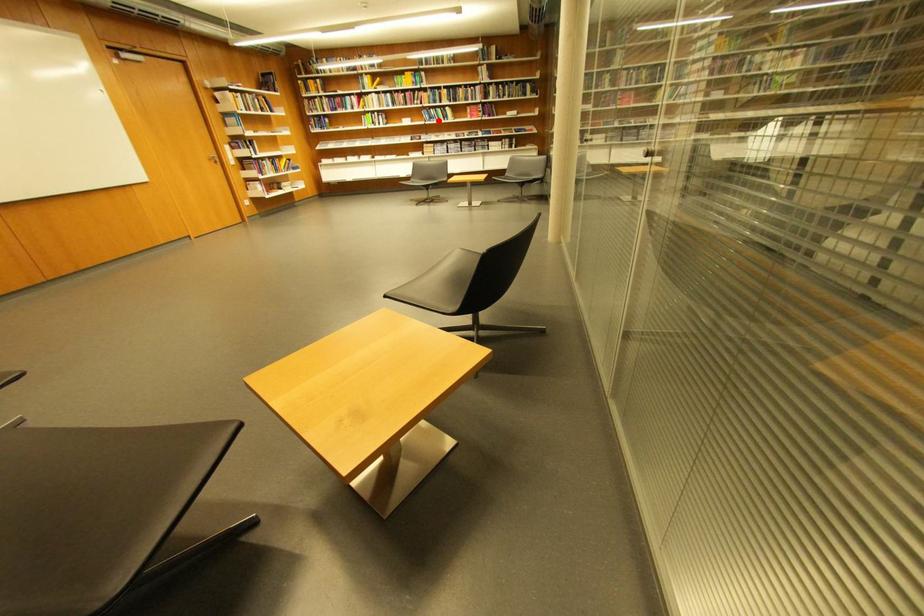
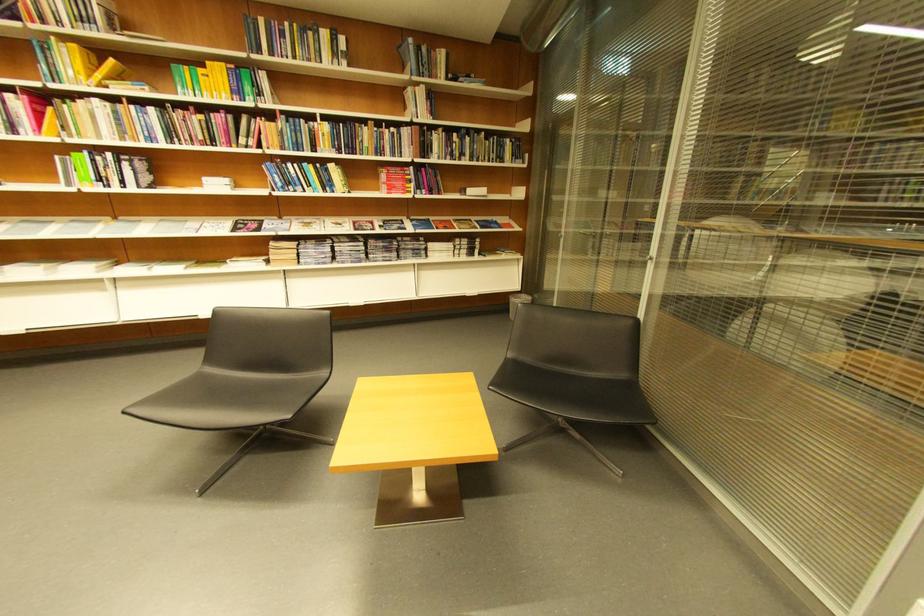
Question: I am providing you with two images of the same scene from different viewpoints. Given a red point in image1, look at the same physical point in image2. Is it:

Choices:
 (A) Closer to the viewpoint
 (B) Farther from the viewpoint

Answer: (B)